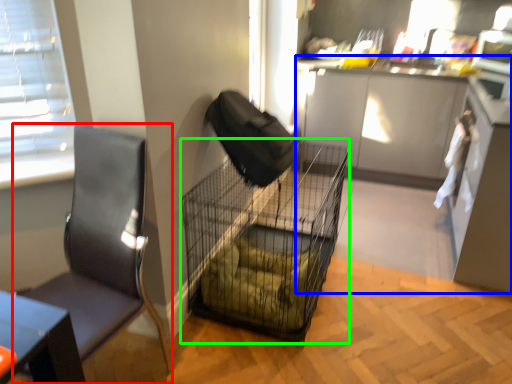
Question: Which is farther away from chair (highlighted by a red box)? cabinetry (highlighted by a blue box) or bird cage (highlighted by a green box)?

Choices:
 (A) cabinetry
 (B) bird cage

Answer: (A)